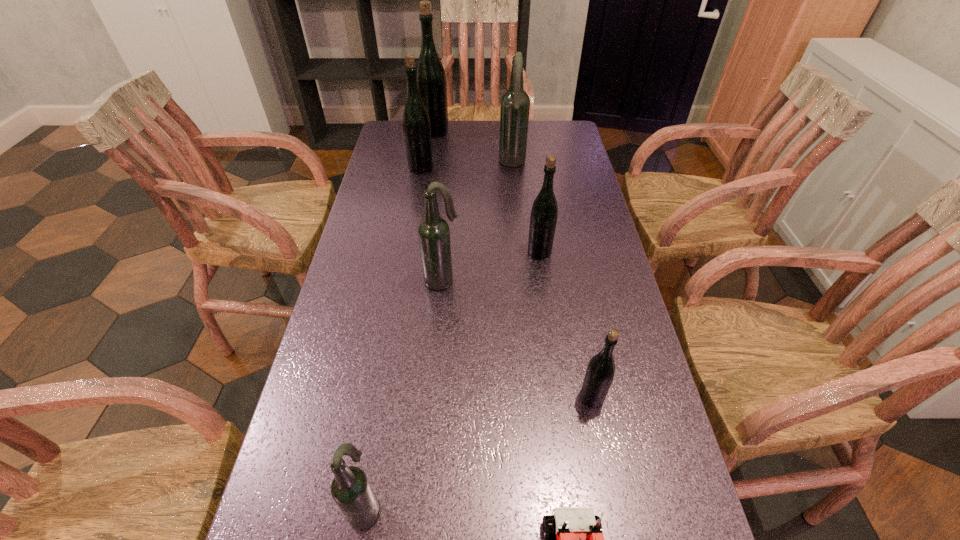
Where is `the tallest beer bottle`? the tallest beer bottle is located at coordinates (431, 78).

In order to click on the biggest green beer bottle in this screenshot , I will do `click(431, 78)`.

You are a GUI agent. You are given a task and a screenshot of the screen. Output one action in this format:
    pyautogui.click(x=<x>, y=<y>)
    Task: Click on the farthest dark beer bottle
    This screenshot has width=960, height=540.
    Given the screenshot: What is the action you would take?
    pyautogui.click(x=515, y=104)

Identify the location of the rightmost dark beer bottle. (515, 104).

I want to click on the second farthest green beer bottle, so click(416, 124).

Identify the location of the fifth nearest object. (544, 212).

This screenshot has height=540, width=960. What are the coordinates of `the fourth nearest beer bottle` in the screenshot? It's located at (544, 212).

I want to click on the fifth farthest beer bottle, so (433, 231).

The width and height of the screenshot is (960, 540). In order to click on the fifth farthest object in this screenshot , I will do `click(433, 231)`.

The image size is (960, 540). Find the location of `the nearest green beer bottle`. the nearest green beer bottle is located at coordinates (599, 375).